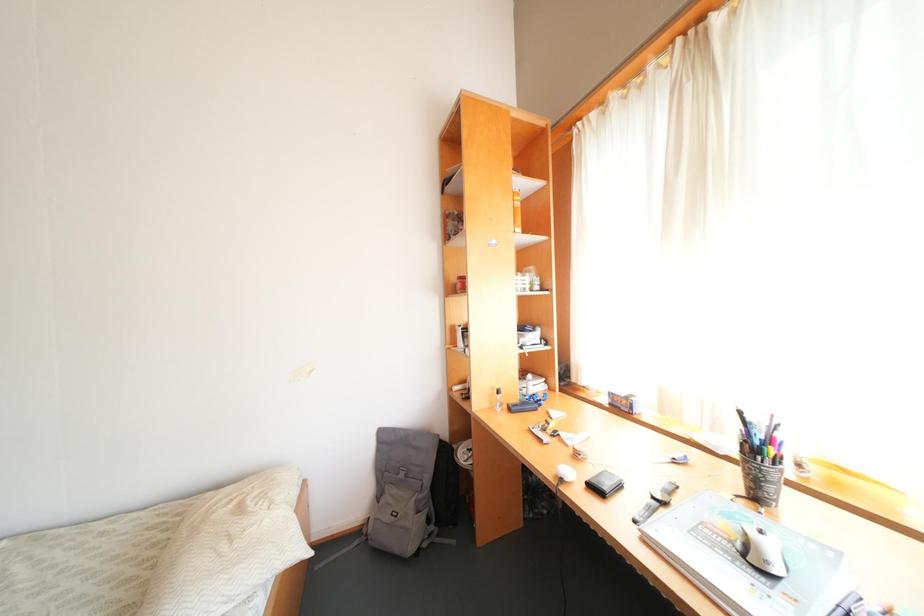
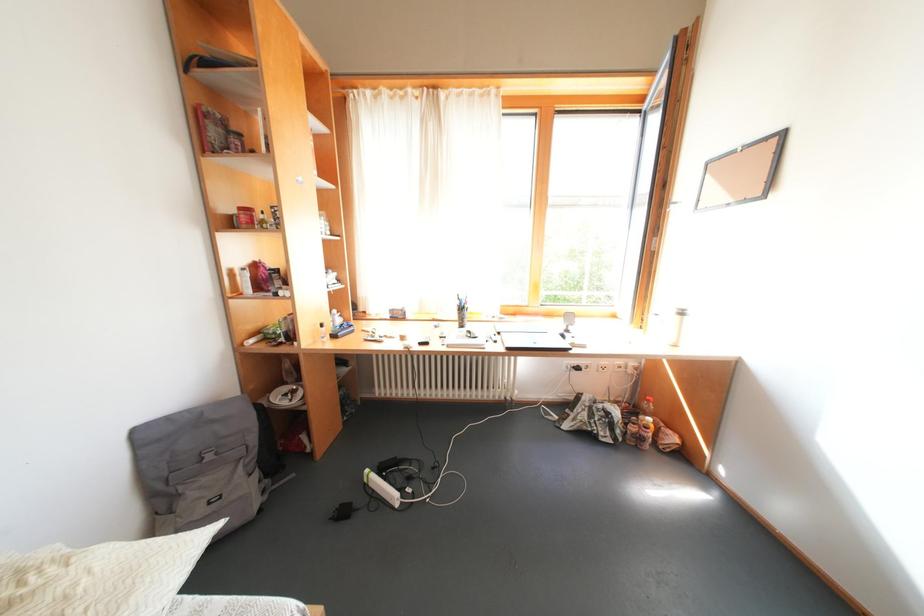
Question: Based on the continuous images, in which direction is the camera rotating? Reply with the corresponding letter.

Choices:
 (A) Left
 (B) Right
 (C) Up
 (D) Down

Answer: (B)